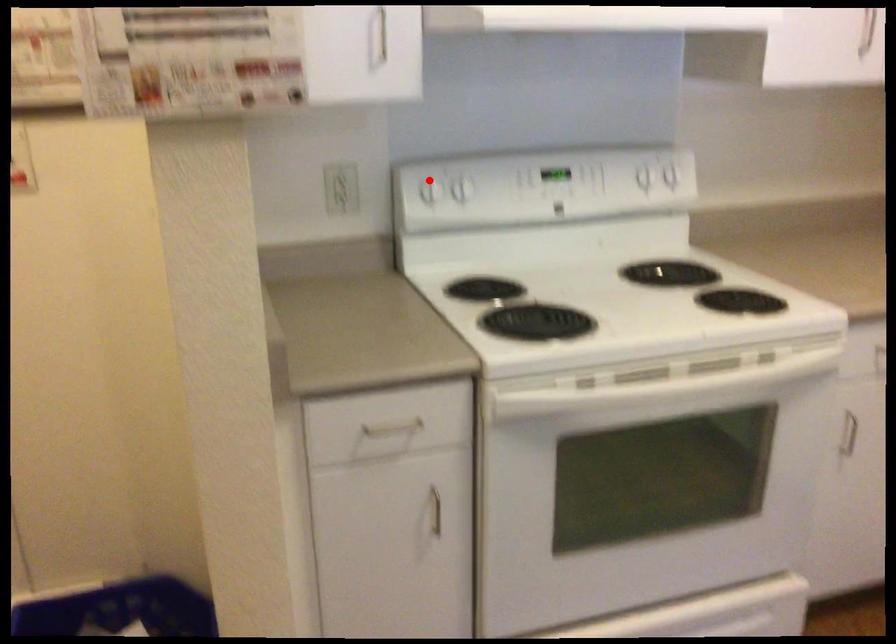
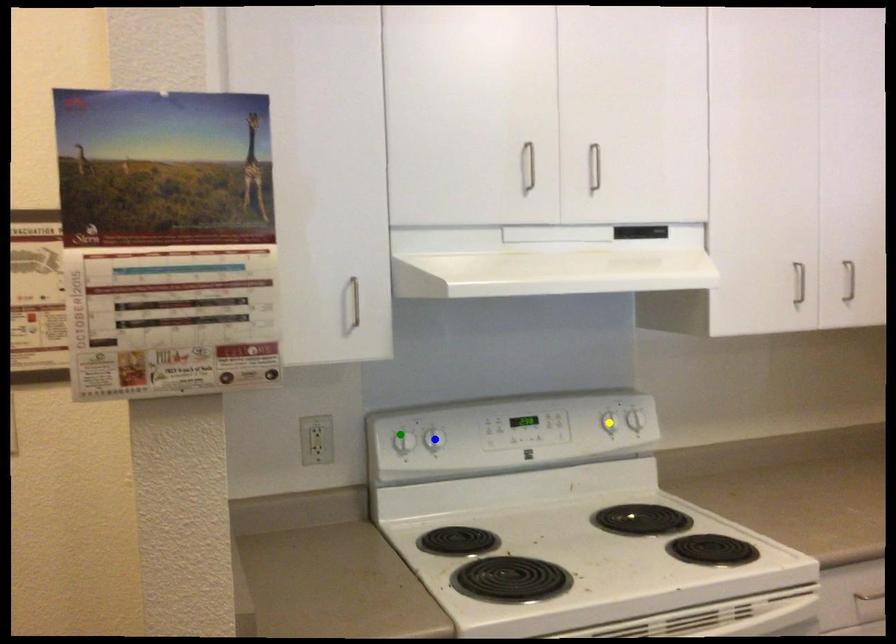
Question: I am providing you with two images of the same scene from different viewpoints. A red point is marked on the first image. You are given multiple points on the second image. Which point in image 2 represents the same 3d spot as the red point in image 1?

Choices:
 (A) blue point
 (B) green point
 (C) yellow point

Answer: (B)